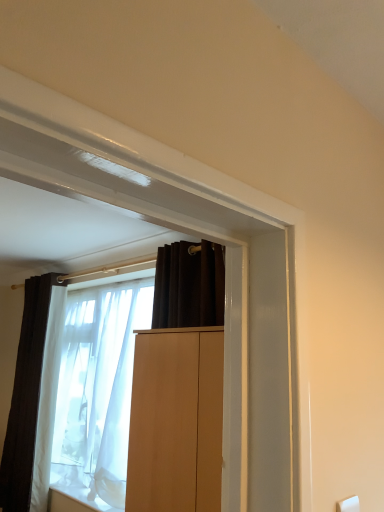
Question: Considering the relative positions of light brown wood cabinet at center and white sheer fabric at center in the image provided, is light brown wood cabinet at center to the left of white sheer fabric at center from the viewer's perspective?

Choices:
 (A) yes
 (B) no

Answer: (B)

Question: From the image's perspective, is light brown wood cabinet at center located beneath white sheer fabric at center?

Choices:
 (A) yes
 (B) no

Answer: (B)

Question: From a real-world perspective, is light brown wood cabinet at center beneath white sheer fabric at center?

Choices:
 (A) no
 (B) yes

Answer: (A)

Question: Would you consider light brown wood cabinet at center to be distant from white sheer fabric at center?

Choices:
 (A) no
 (B) yes

Answer: (B)

Question: Can we say light brown wood cabinet at center lies outside white sheer fabric at center?

Choices:
 (A) yes
 (B) no

Answer: (A)

Question: Is white matte window sill at lower left wider or thinner than translucent fabric window at center?

Choices:
 (A) wide
 (B) thin

Answer: (B)

Question: From a real-world perspective, is white matte window sill at lower left above or below translucent fabric window at center?

Choices:
 (A) above
 (B) below

Answer: (B)

Question: From their relative heights in the image, would you say white matte window sill at lower left is taller or shorter than translucent fabric window at center?

Choices:
 (A) short
 (B) tall

Answer: (A)

Question: Which is correct: white matte window sill at lower left is inside translucent fabric window at center, or outside of it?

Choices:
 (A) inside
 (B) outside

Answer: (B)

Question: From the image's perspective, is translucent fabric window at center above or below white sheer fabric at center?

Choices:
 (A) above
 (B) below

Answer: (A)

Question: In the image, is translucent fabric window at center positioned in front of or behind white sheer fabric at center?

Choices:
 (A) front
 (B) behind

Answer: (A)

Question: Is translucent fabric window at center situated inside white sheer fabric at center or outside?

Choices:
 (A) inside
 (B) outside

Answer: (A)

Question: From their relative heights in the image, would you say translucent fabric window at center is taller or shorter than white sheer fabric at center?

Choices:
 (A) tall
 (B) short

Answer: (B)

Question: Considering the positions of point (39, 356) and point (135, 464), is point (39, 356) closer or farther from the camera than point (135, 464)?

Choices:
 (A) farther
 (B) closer

Answer: (A)

Question: From a real-world perspective, is dark matte curtain at left positioned above or below translucent fabric window at center?

Choices:
 (A) below
 (B) above

Answer: (A)